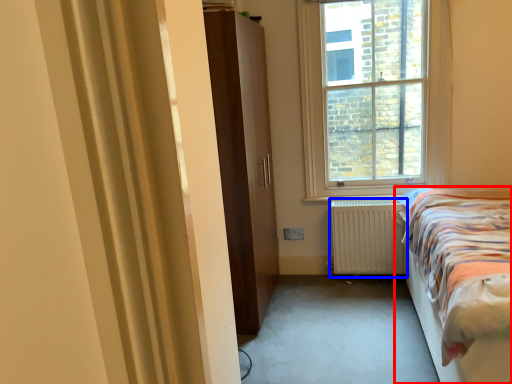
Question: Which object is closer to the camera taking this photo, bed (highlighted by a red box) or radiator (highlighted by a blue box)?

Choices:
 (A) bed
 (B) radiator

Answer: (A)